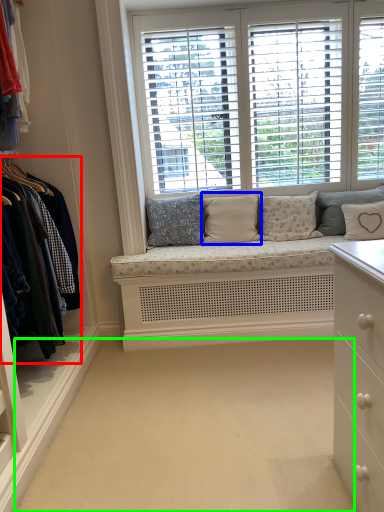
Question: Considering the real-world distances, which object is farthest from closet (highlighted by a red box)? pillow (highlighted by a blue box) or plain (highlighted by a green box)?

Choices:
 (A) pillow
 (B) plain

Answer: (A)